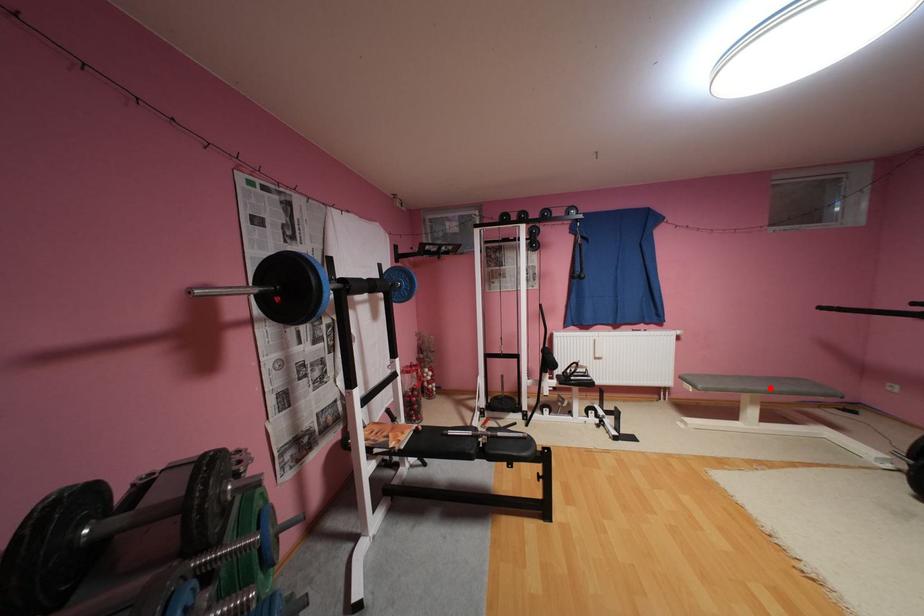
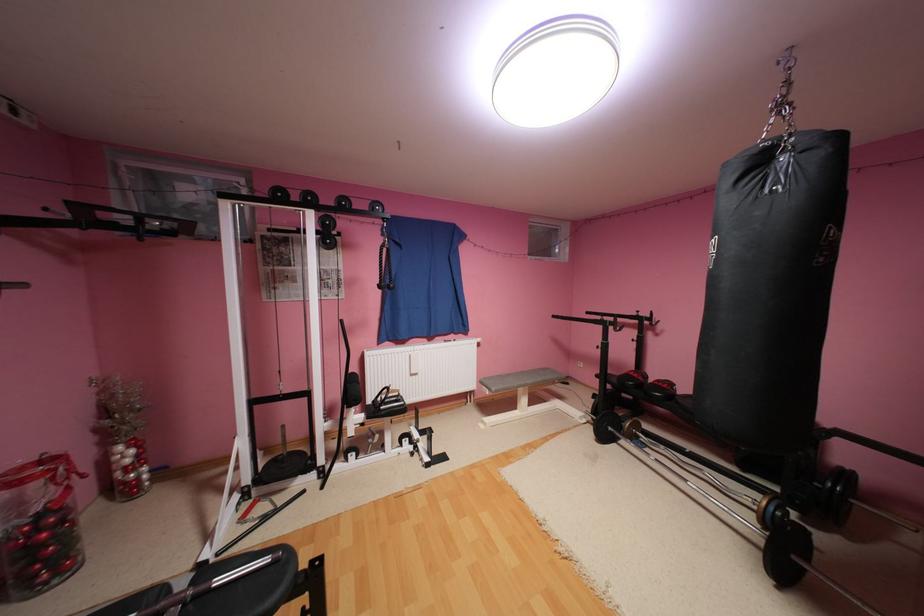
Locate, in the second image, the point that corresponds to the highlighted location in the first image.

(538, 382)